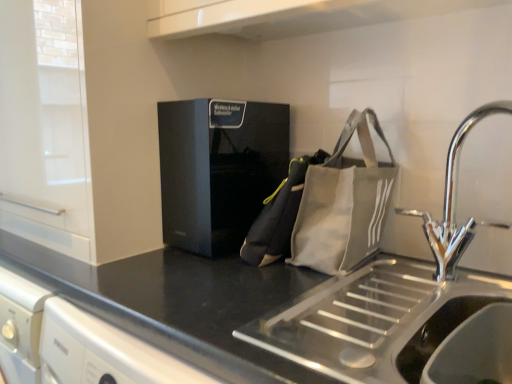
Question: Is canvas messenger bag at center closer to the viewer compared to stainless steel sink at lower right?

Choices:
 (A) yes
 (B) no

Answer: (B)

Question: Considering the relative sizes of canvas messenger bag at center and stainless steel sink at lower right in the image provided, is canvas messenger bag at center bigger than stainless steel sink at lower right?

Choices:
 (A) no
 (B) yes

Answer: (B)

Question: Does canvas messenger bag at center turn towards stainless steel sink at lower right?

Choices:
 (A) yes
 (B) no

Answer: (B)

Question: Is canvas messenger bag at center next to stainless steel sink at lower right?

Choices:
 (A) yes
 (B) no

Answer: (B)

Question: From the image's perspective, is canvas messenger bag at center located above stainless steel sink at lower right?

Choices:
 (A) yes
 (B) no

Answer: (A)

Question: Based on their positions, is black matte countertop at center located to the left or right of black matte speaker at center?

Choices:
 (A) right
 (B) left

Answer: (A)

Question: From a real-world perspective, is black matte countertop at center above or below black matte speaker at center?

Choices:
 (A) below
 (B) above

Answer: (A)

Question: Relative to black matte speaker at center, is black matte countertop at center in front or behind?

Choices:
 (A) front
 (B) behind

Answer: (A)

Question: From the image's perspective, is black matte countertop at center positioned above or below black matte speaker at center?

Choices:
 (A) above
 (B) below

Answer: (B)

Question: In terms of height, does canvas messenger bag at center look taller or shorter compared to gray canvas tote bag at right?

Choices:
 (A) short
 (B) tall

Answer: (A)

Question: Considering their positions, is canvas messenger bag at center located in front of or behind gray canvas tote bag at right?

Choices:
 (A) front
 (B) behind

Answer: (B)

Question: Which is correct: canvas messenger bag at center is inside gray canvas tote bag at right, or outside of it?

Choices:
 (A) inside
 (B) outside

Answer: (B)

Question: From the image's perspective, is canvas messenger bag at center located above or below gray canvas tote bag at right?

Choices:
 (A) below
 (B) above

Answer: (A)

Question: Considering their positions, is canvas messenger bag at center located in front of or behind chrome metallic tap at right?

Choices:
 (A) behind
 (B) front

Answer: (A)

Question: Considering the positions of canvas messenger bag at center and chrome metallic tap at right in the image, is canvas messenger bag at center bigger or smaller than chrome metallic tap at right?

Choices:
 (A) small
 (B) big

Answer: (B)